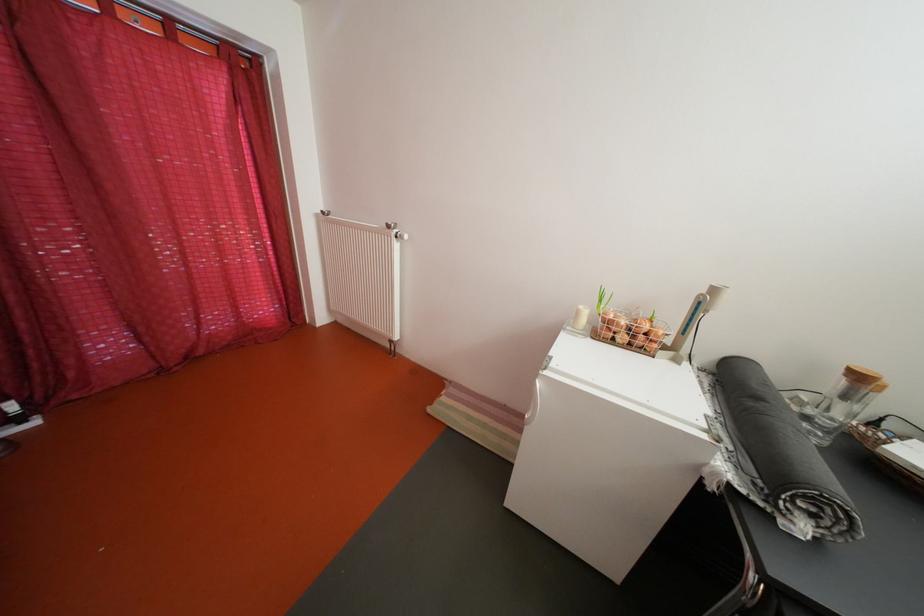
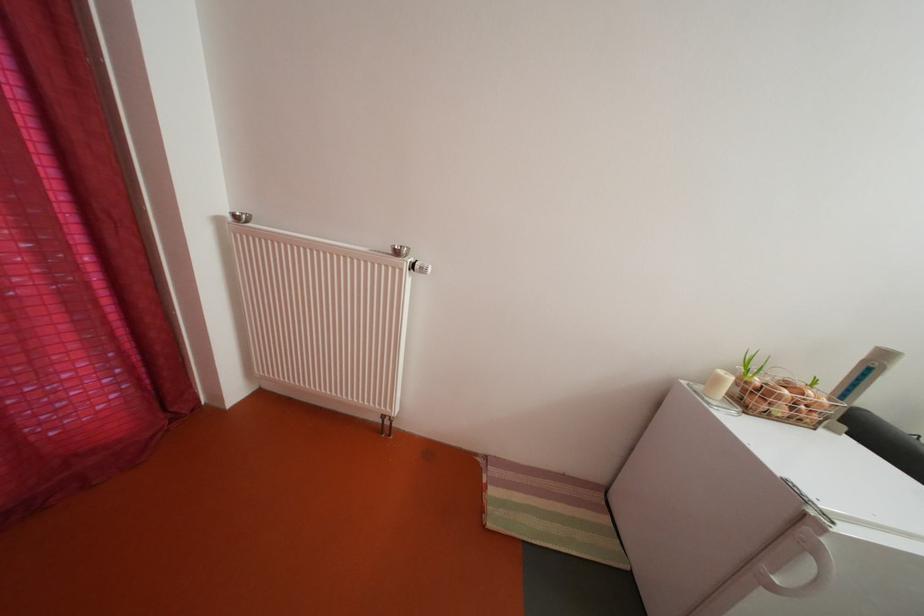
Locate, in the second image, the point that corresponds to the point at 589,318 in the first image.

(728, 386)